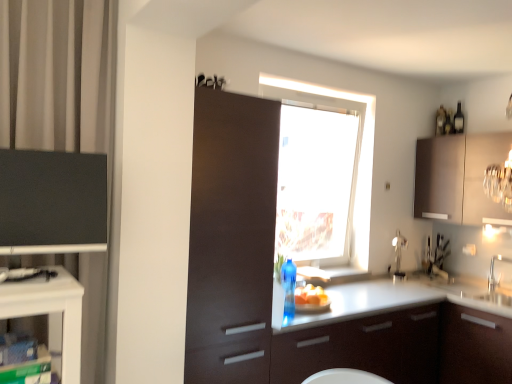
Locate an element on the screen. The width and height of the screenshot is (512, 384). vacant space behind yellow matte bread at lower center is located at coordinates (313, 305).